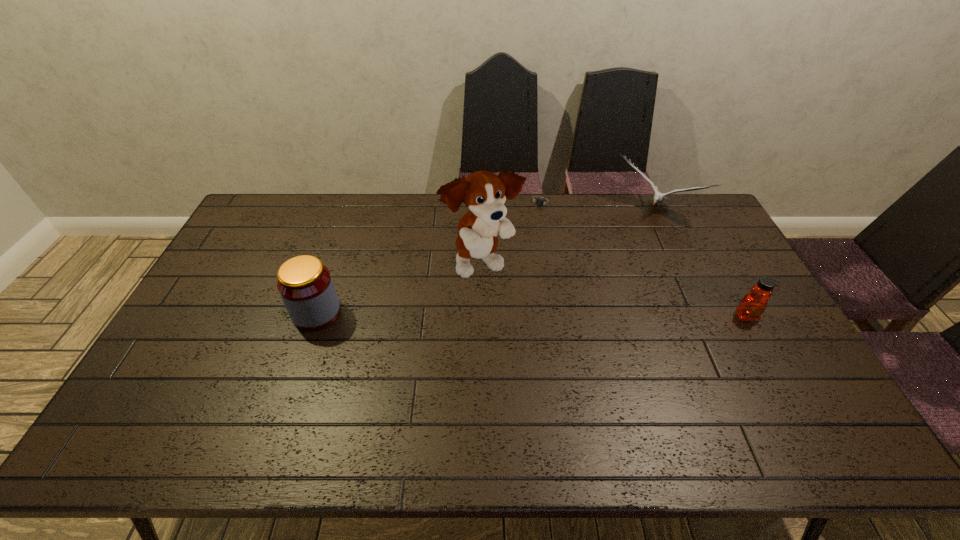
This screenshot has width=960, height=540. Find the location of `honey present at the right edge`. honey present at the right edge is located at coordinates (752, 306).

Identify the location of gull located at the right edge. Image resolution: width=960 pixels, height=540 pixels. pyautogui.click(x=658, y=197).

The width and height of the screenshot is (960, 540). Find the location of `object located in the far right corner section of the desktop`. object located in the far right corner section of the desktop is located at coordinates (658, 197).

The image size is (960, 540). I want to click on vacant space at the far edge, so click(640, 200).

In the image, there is a desktop. Identify the location of free space at the near edge. (722, 385).

This screenshot has width=960, height=540. Identify the location of vacant space at the right edge of the desktop. (758, 341).

Locate an element on the screen. free point at the far left corner is located at coordinates (266, 211).

The width and height of the screenshot is (960, 540). I want to click on unoccupied area between the leftmost object and the puppy, so click(x=399, y=288).

You are a GUI agent. You are given a task and a screenshot of the screen. Output one action in this format:
    pyautogui.click(x=<x>, y=<y>)
    Task: Click on the free area in between the third object from right to left and the jar
    The image size is (960, 540).
    Given the screenshot: What is the action you would take?
    pyautogui.click(x=429, y=258)

Locate an element on the screen. This screenshot has width=960, height=540. vacant area that lies between the jar and the honey is located at coordinates (532, 314).